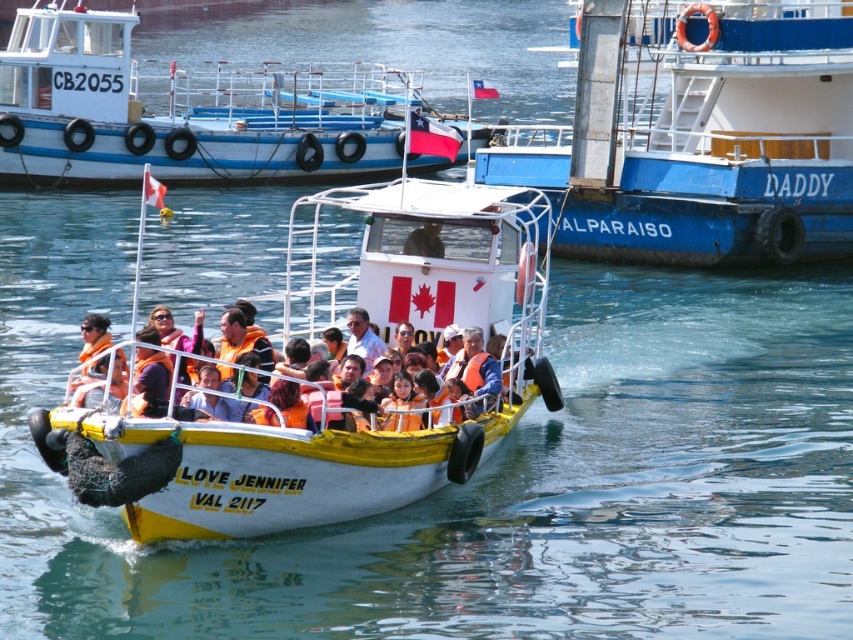
You are a safety inspector checking equipment on board the white matte boat at upper center and the smooth white helmet at center. Which object requires more storage space due to its size?

The white matte boat at upper center requires more storage space because it is larger in size than the smooth white helmet at center.